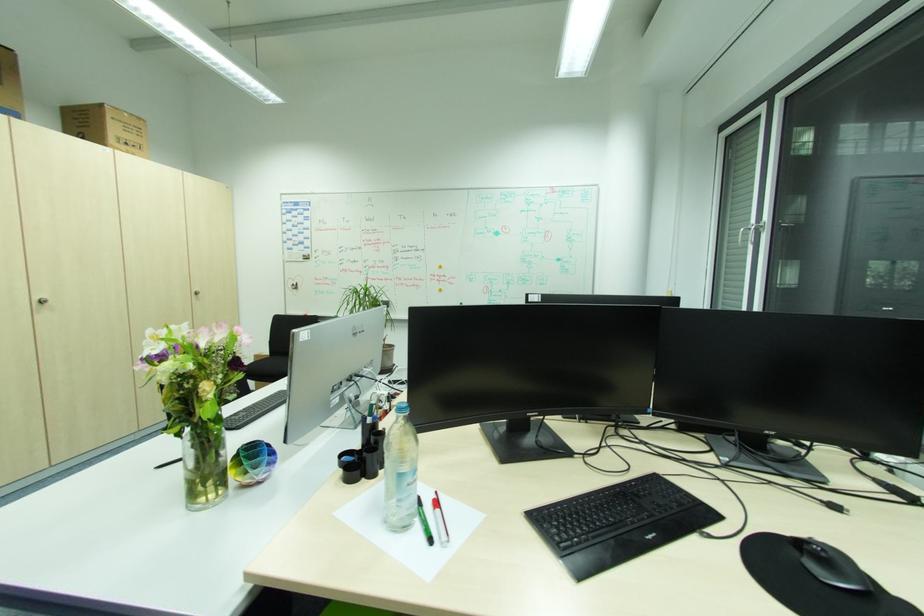
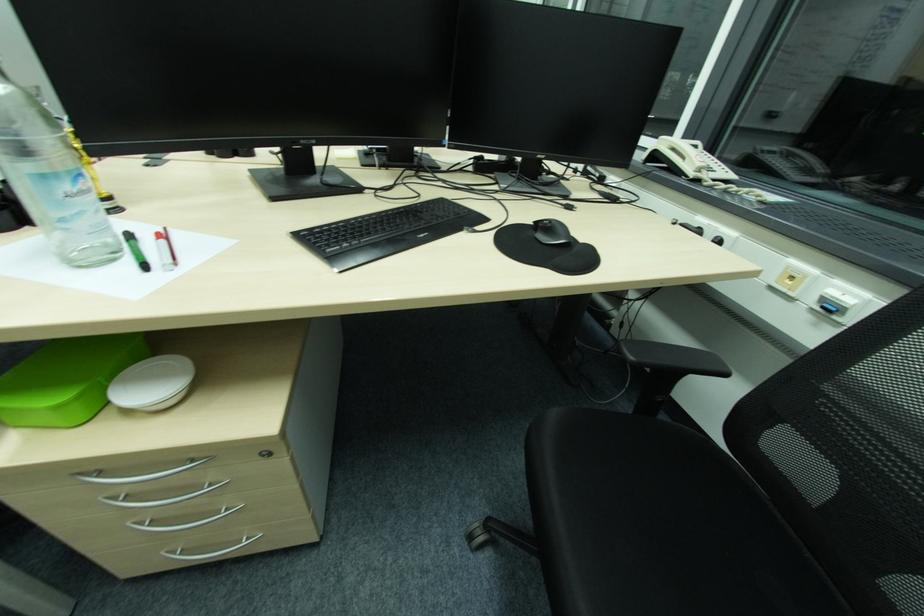
In the second image, find the point that corresponds to pixel 829 554 in the first image.

(554, 225)